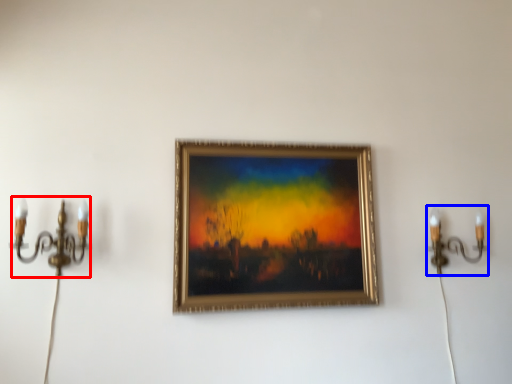
Question: Which object is further to the camera taking this photo, candle holder (highlighted by a red box) or candle holder (highlighted by a blue box)?

Choices:
 (A) candle holder
 (B) candle holder

Answer: (B)